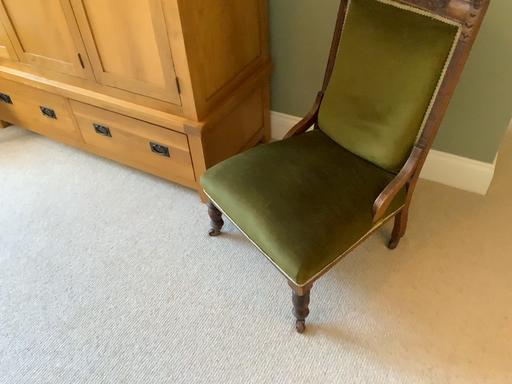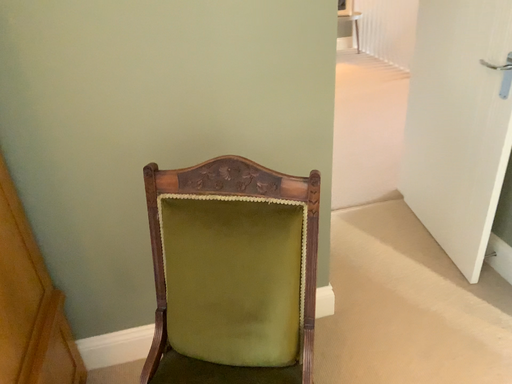
Question: Which way did the camera rotate in the video?

Choices:
 (A) rotated upward
 (B) rotated downward

Answer: (A)